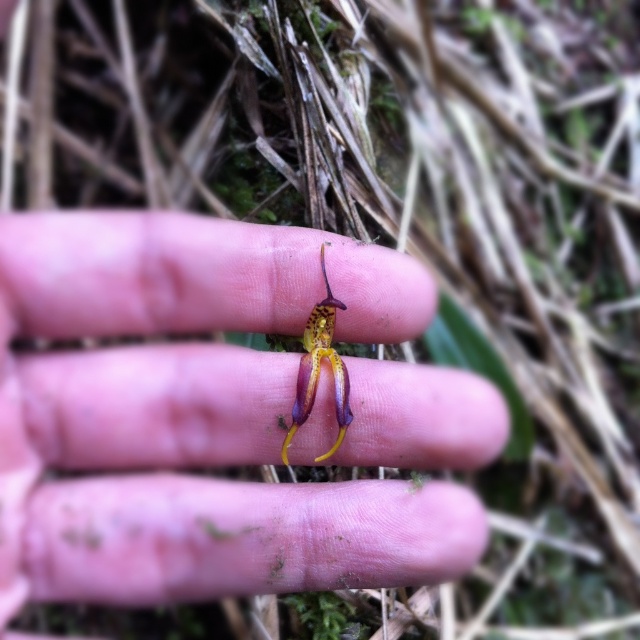
Question: Where is matte yellow flower at center located in relation to shiny yellow-green flower at center in the image?

Choices:
 (A) above
 (B) below

Answer: (B)

Question: Does matte yellow flower at center have a lesser width compared to shiny yellow-green flower at center?

Choices:
 (A) yes
 (B) no

Answer: (B)

Question: Does matte yellow flower at center have a smaller size compared to shiny yellow-green flower at center?

Choices:
 (A) yes
 (B) no

Answer: (B)

Question: Which object is farther from the camera taking this photo?

Choices:
 (A) shiny yellow-green flower at center
 (B) matte yellow flower at center

Answer: (A)

Question: Which point appears farthest from the camera in this image?

Choices:
 (A) (298, 426)
 (B) (317, 257)

Answer: (B)